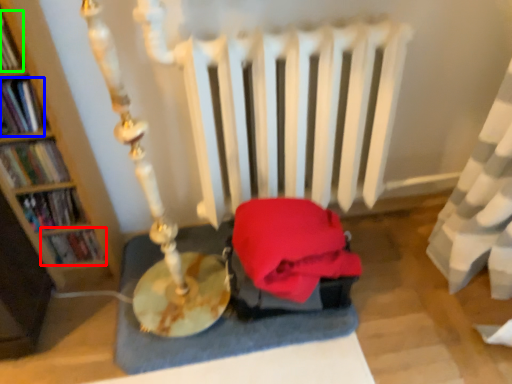
Question: Which is farther away from book (highlighted by a red box)? book (highlighted by a blue box) or book (highlighted by a green box)?

Choices:
 (A) book
 (B) book

Answer: (B)